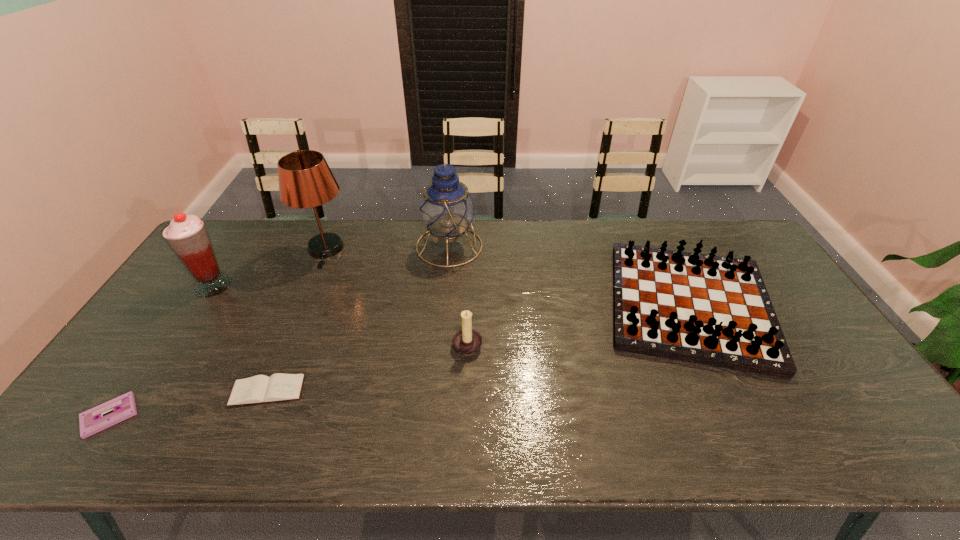
The height and width of the screenshot is (540, 960). I want to click on free space between the lantern and the lampshade, so [387, 248].

This screenshot has width=960, height=540. What are the coordinates of `free space that is in between the third tallest object and the diary` in the screenshot? It's located at (240, 338).

At what (x,y) coordinates should I click in order to perform the action: click on blank region between the candle holder and the second shortest object. Please return your answer as a coordinate pair (x, y). This screenshot has width=960, height=540. Looking at the image, I should click on (368, 367).

Identify the location of free spot between the lampshade and the candle holder. Image resolution: width=960 pixels, height=540 pixels. (396, 296).

Locate an element on the screen. This screenshot has height=540, width=960. free spot between the shortest object and the lampshade is located at coordinates (217, 333).

What are the coordinates of `vacant space that is in between the fifth shortest object and the candle holder` in the screenshot? It's located at (341, 314).

Locate an element on the screen. The image size is (960, 540). free spot between the smoothie and the shortest object is located at coordinates (161, 350).

You are a GUI agent. You are given a task and a screenshot of the screen. Output one action in this format:
    pyautogui.click(x=<x>, y=<y>)
    Task: Click on the free point between the lampshade and the chessboard
    This screenshot has height=540, width=960.
    Given the screenshot: What is the action you would take?
    pyautogui.click(x=507, y=277)

This screenshot has width=960, height=540. What are the coordinates of `empty space that is in between the shortest object and the lampshade` in the screenshot? It's located at pyautogui.click(x=217, y=333).

Where is `object that ranks as the closest to the candle holder`? object that ranks as the closest to the candle holder is located at coordinates (447, 209).